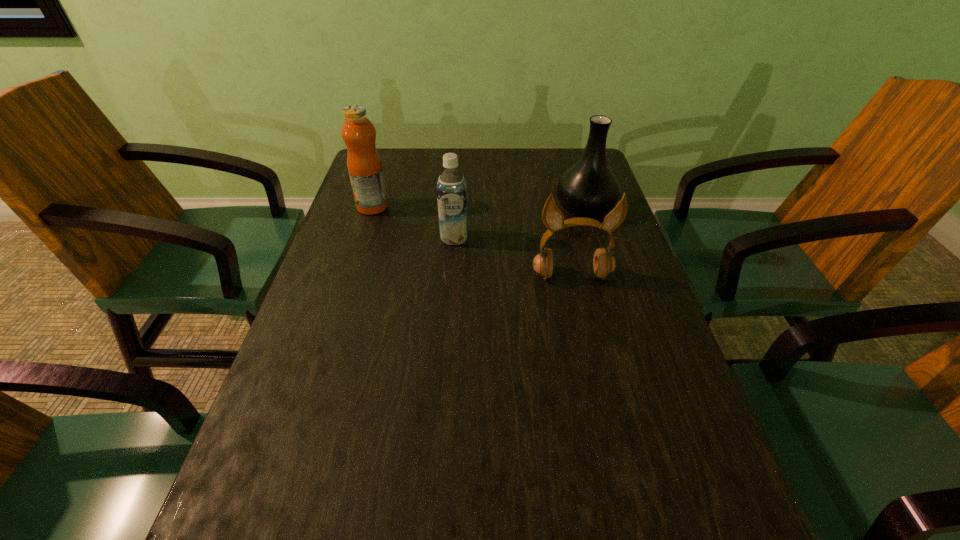
Find the location of a particular element. This screenshot has width=960, height=540. fruit juice is located at coordinates (364, 164).

Find the location of a particular element. This screenshot has height=540, width=960. vase is located at coordinates (588, 189).

This screenshot has width=960, height=540. I want to click on soya milk, so click(451, 186).

Find the location of `the second nearest object`. the second nearest object is located at coordinates (451, 186).

Locate an element on the screen. This screenshot has width=960, height=540. the nearest object is located at coordinates (x=604, y=263).

Where is `vacant point located 0.300m on the back of the fruit juice`? vacant point located 0.300m on the back of the fruit juice is located at coordinates coord(391,149).

Where is `free space located 0.090m on the back of the vase`? This screenshot has width=960, height=540. free space located 0.090m on the back of the vase is located at coordinates (575, 177).

This screenshot has height=540, width=960. I want to click on blank area located on the label of the third farthest object, so click(x=450, y=301).

I want to click on vacant area located on the front-facing side of the earphone, so click(596, 385).

Locate an element on the screen. The width and height of the screenshot is (960, 540). object that is positioned at the left edge is located at coordinates (364, 164).